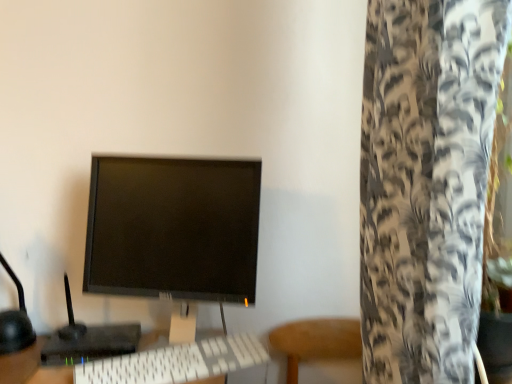
Question: Can black matte monitor at center be found inside white plastic keyboard at center?

Choices:
 (A) no
 (B) yes

Answer: (A)

Question: Is white plastic keyboard at center not inside black matte monitor at center?

Choices:
 (A) no
 (B) yes

Answer: (A)

Question: Can you confirm if white plastic keyboard at center is positioned to the right of black matte monitor at center?

Choices:
 (A) yes
 (B) no

Answer: (A)

Question: Considering the relative sizes of white plastic keyboard at center and black matte monitor at center in the image provided, is white plastic keyboard at center taller than black matte monitor at center?

Choices:
 (A) yes
 (B) no

Answer: (B)

Question: Is white plastic keyboard at center facing away from black matte monitor at center?

Choices:
 (A) yes
 (B) no

Answer: (A)

Question: From the image's perspective, is black plastic monitor at center located above or below white plastic keyboard at center?

Choices:
 (A) below
 (B) above

Answer: (B)

Question: Would you say black plastic monitor at center is to the left or to the right of white plastic keyboard at center in the picture?

Choices:
 (A) left
 (B) right

Answer: (A)

Question: In terms of height, does black plastic monitor at center look taller or shorter compared to white plastic keyboard at center?

Choices:
 (A) short
 (B) tall

Answer: (B)

Question: Considering the positions of point (123, 327) and point (150, 370), is point (123, 327) closer or farther from the camera than point (150, 370)?

Choices:
 (A) farther
 (B) closer

Answer: (A)

Question: From the image's perspective, is white textured curtain at right located above or below black matte monitor at center?

Choices:
 (A) below
 (B) above

Answer: (B)

Question: Is point (406, 231) closer or farther from the camera than point (92, 261)?

Choices:
 (A) closer
 (B) farther

Answer: (A)

Question: Looking at their shapes, would you say white textured curtain at right is wider or thinner than black matte monitor at center?

Choices:
 (A) thin
 (B) wide

Answer: (B)

Question: Based on their sizes in the image, would you say white textured curtain at right is bigger or smaller than black matte monitor at center?

Choices:
 (A) small
 (B) big

Answer: (B)

Question: Considering their positions, is black matte monitor at center located in front of or behind black plastic monitor at center?

Choices:
 (A) behind
 (B) front

Answer: (B)

Question: In terms of height, does black matte monitor at center look taller or shorter compared to black plastic monitor at center?

Choices:
 (A) tall
 (B) short

Answer: (A)